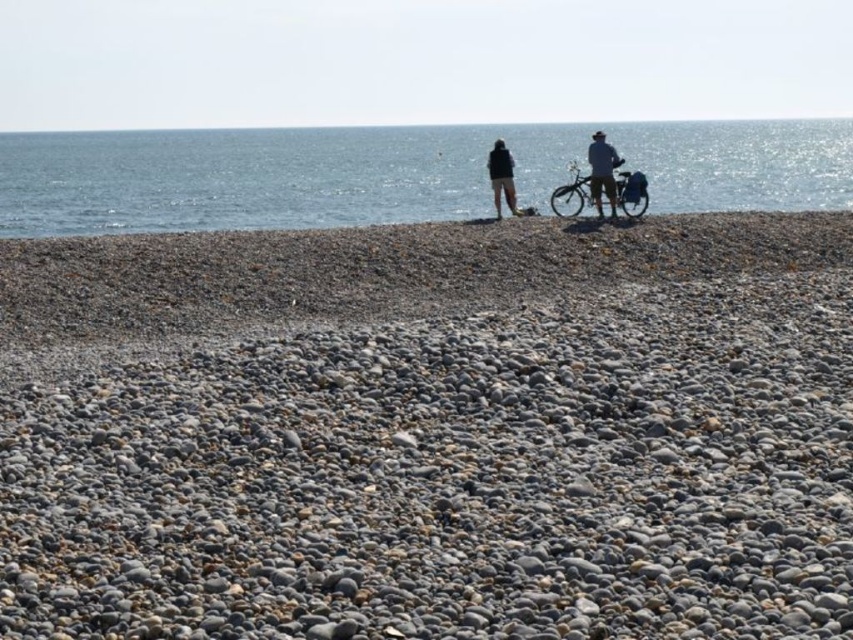
You are planning to take a short walk on the beach. You see the smooth pebbles at center and the shiny metallic bicycle at right. Which surface would be more comfortable to walk on, and why?

The smooth pebbles at center are in front of the shiny metallic bicycle at right. Walking on the smooth pebbles at center would be more comfortable because they are flat and spread out, whereas the bicycle is a hard, narrow surface that would be uncomfortable to walk on.

You are a photographer trying to capture both the matte black jacket at center and the light blue denim jacket at center in a single frame. Since you want to ensure both are clearly visible, which jacket should you focus on first to account for their sizes?

The matte black jacket at center is bigger than the light blue denim jacket at center, so you should focus on the matte black jacket at center first as it occupies more space in the frame.

You are standing on the beach and see two points marked on the pebbles. The first point is at coordinates point (593, 202) and the second is at point (593, 198). Which point is closer to you?

Point (593, 202) is in front of point (593, 198), so it is closer to you.